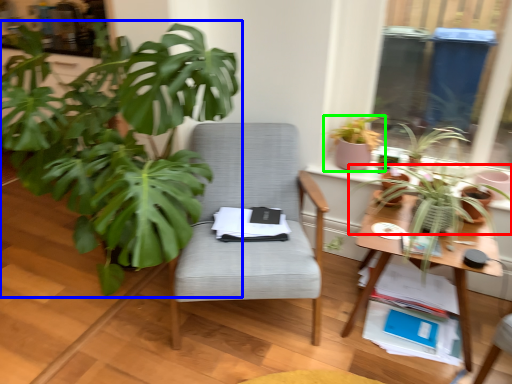
Question: Which object is positioned farthest from houseplant (highlighted by a red box)? Select from houseplant (highlighted by a blue box) and houseplant (highlighted by a green box).

Choices:
 (A) houseplant
 (B) houseplant

Answer: (A)